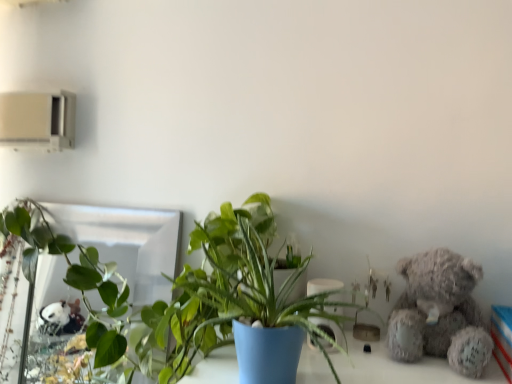
Question: Is fuzzy gray teddy bear at right surrounding blue matte pot at center?

Choices:
 (A) yes
 (B) no

Answer: (B)

Question: Is fuzzy gray teddy bear at right shorter than blue matte pot at center?

Choices:
 (A) no
 (B) yes

Answer: (B)

Question: From the image's perspective, does fuzzy gray teddy bear at right appear higher than blue matte pot at center?

Choices:
 (A) yes
 (B) no

Answer: (B)

Question: Does fuzzy gray teddy bear at right have a greater height compared to blue matte pot at center?

Choices:
 (A) no
 (B) yes

Answer: (A)

Question: Considering the relative positions of fuzzy gray teddy bear at right and blue matte pot at center in the image provided, is fuzzy gray teddy bear at right to the right of blue matte pot at center from the viewer's perspective?

Choices:
 (A) yes
 (B) no

Answer: (A)

Question: From a real-world perspective, is fuzzy gray teddy bear at right on blue matte pot at center?

Choices:
 (A) yes
 (B) no

Answer: (B)

Question: Is fuzzy gray teddy bear at right bigger than silver reflective mirror at upper left?

Choices:
 (A) no
 (B) yes

Answer: (A)

Question: Does fuzzy gray teddy bear at right have a lesser height compared to silver reflective mirror at upper left?

Choices:
 (A) no
 (B) yes

Answer: (B)

Question: From a real-world perspective, is fuzzy gray teddy bear at right under silver reflective mirror at upper left?

Choices:
 (A) no
 (B) yes

Answer: (A)

Question: Is fuzzy gray teddy bear at right to the left of silver reflective mirror at upper left from the viewer's perspective?

Choices:
 (A) yes
 (B) no

Answer: (B)

Question: Can you see fuzzy gray teddy bear at right touching silver reflective mirror at upper left?

Choices:
 (A) no
 (B) yes

Answer: (A)

Question: Does fuzzy gray teddy bear at right have a greater width compared to silver reflective mirror at upper left?

Choices:
 (A) yes
 (B) no

Answer: (A)

Question: From a real-world perspective, is silver reflective mirror at upper left physically above fuzzy gray teddy bear at right?

Choices:
 (A) yes
 (B) no

Answer: (B)